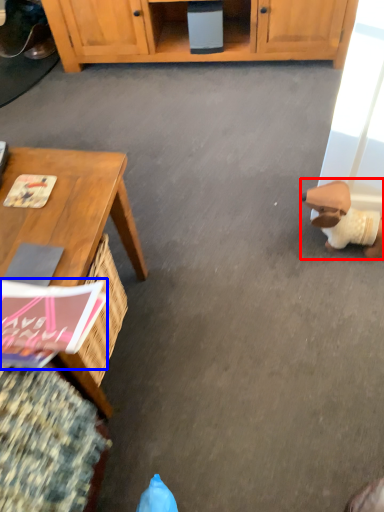
Question: Which object is further to the camera taking this photo, toy (highlighted by a red box) or magazine (highlighted by a blue box)?

Choices:
 (A) toy
 (B) magazine

Answer: (A)